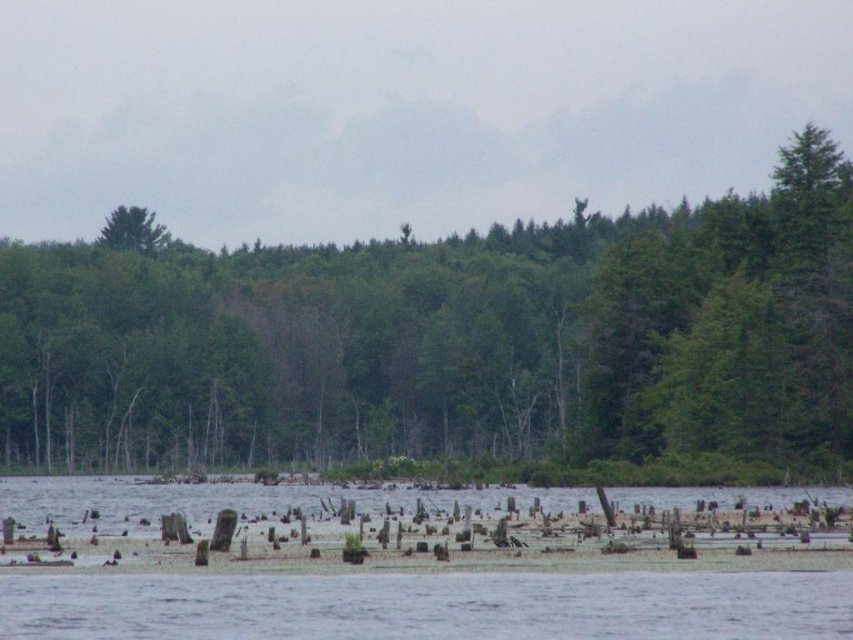
Question: Which of the following is the closest to the observer?

Choices:
 (A) transparent water at lower center
 (B) green matte tree at center

Answer: (A)

Question: Does transparent water at lower center appear on the right side of green matte tree at upper left?

Choices:
 (A) no
 (B) yes

Answer: (B)

Question: Is green matte tree at center below green matte tree at upper left?

Choices:
 (A) no
 (B) yes

Answer: (B)

Question: Which of the following is the farthest from the observer?

Choices:
 (A) green matte tree at upper left
 (B) transparent water at lower center
 (C) green matte tree at center

Answer: (A)

Question: Which point is closer to the camera taking this photo?

Choices:
 (A) (369, 365)
 (B) (128, 212)
 (C) (766, 634)

Answer: (C)

Question: Is green matte tree at center wider than transparent water at lower center?

Choices:
 (A) no
 (B) yes

Answer: (B)